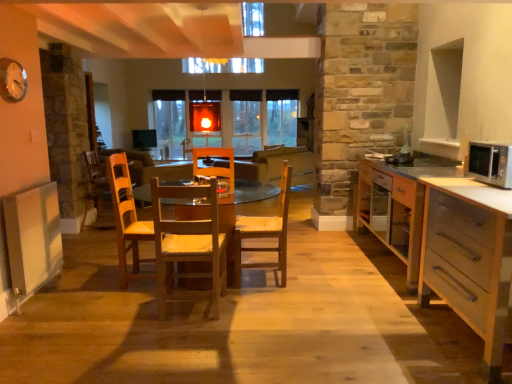
Question: Can you confirm if wooden chair at center, marked as the 2th chair in a front-to-back arrangement, is shorter than silver metallic microwave at right?

Choices:
 (A) yes
 (B) no

Answer: (B)

Question: Are wooden chair at center, acting as the 2th chair starting from the left, and silver metallic microwave at right making contact?

Choices:
 (A) yes
 (B) no

Answer: (B)

Question: Is wooden chair at center, acting as the 2th chair starting from the left, not near silver metallic microwave at right?

Choices:
 (A) yes
 (B) no

Answer: (A)

Question: Can you confirm if wooden chair at center, positioned as the first chair in right-to-left order, is taller than silver metallic microwave at right?

Choices:
 (A) no
 (B) yes

Answer: (B)

Question: Does wooden chair at center, which appears as the 1th chair when viewed from the back, appear on the right side of silver metallic microwave at right?

Choices:
 (A) no
 (B) yes

Answer: (A)

Question: Does wooden chair at center, positioned as the first chair in right-to-left order, come behind silver metallic microwave at right?

Choices:
 (A) yes
 (B) no

Answer: (A)

Question: Is the depth of wooden chair at center, positioned as the first chair in right-to-left order, less than that of white wood drawer at lower right, marked as the 2th cabinetry in a back-to-front arrangement?

Choices:
 (A) yes
 (B) no

Answer: (B)

Question: Does wooden chair at center, marked as the 2th chair in a front-to-back arrangement, come behind white wood drawer at lower right, the first cabinetry when ordered from front to back?

Choices:
 (A) yes
 (B) no

Answer: (A)

Question: From a real-world perspective, does wooden chair at center, positioned as the first chair in right-to-left order, sit lower than white wood drawer at lower right, the first cabinetry when ordered from front to back?

Choices:
 (A) no
 (B) yes

Answer: (A)

Question: Can you confirm if wooden chair at center, marked as the 2th chair in a front-to-back arrangement, is taller than white wood drawer at lower right, the first cabinetry when ordered from front to back?

Choices:
 (A) no
 (B) yes

Answer: (B)

Question: From the image's perspective, is wooden chair at center, acting as the 2th chair starting from the left, above white wood drawer at lower right, marked as the 2th cabinetry in a back-to-front arrangement?

Choices:
 (A) yes
 (B) no

Answer: (A)

Question: Are wooden chair at center, positioned as the first chair in right-to-left order, and white wood drawer at lower right, marked as the 2th cabinetry in a back-to-front arrangement, beside each other?

Choices:
 (A) no
 (B) yes

Answer: (A)

Question: Is wooden chair at center wider than wooden chair at center, positioned as the 2th chair in back-to-front order?

Choices:
 (A) no
 (B) yes

Answer: (B)